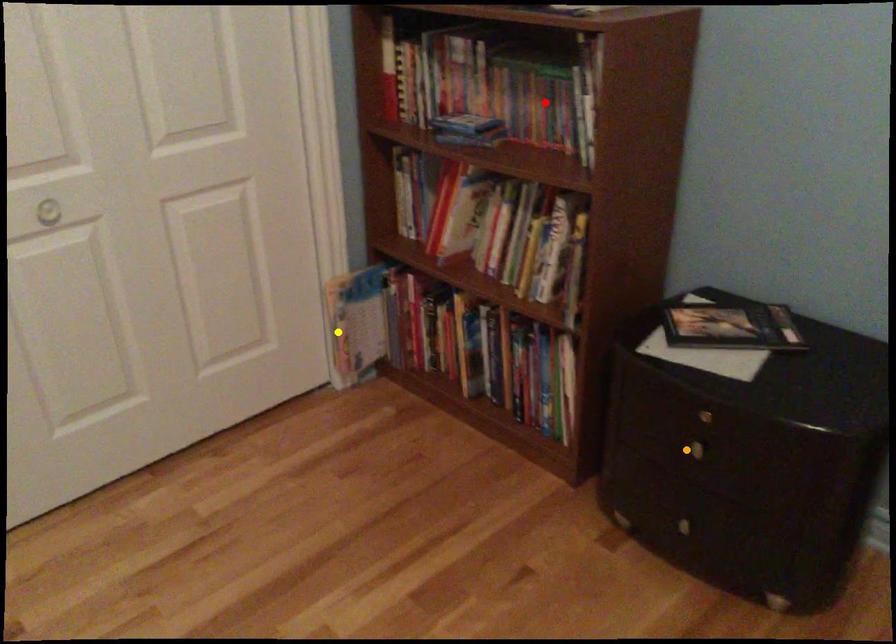
Order these from nearest to farthest:
1. orange point
2. yellow point
3. red point

orange point, red point, yellow point